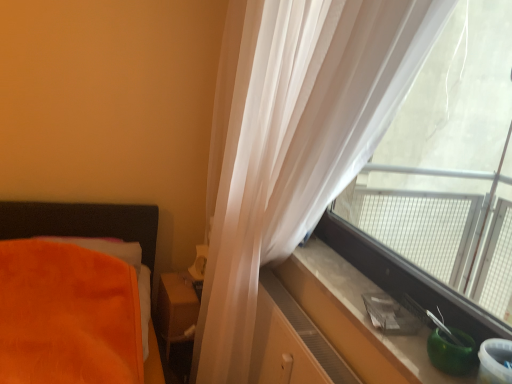
Question: From the image's perspective, does matte wood dresser at lower right appear higher than transparent plastic window at right?

Choices:
 (A) yes
 (B) no

Answer: (B)

Question: Is matte wood dresser at lower right positioned in front of transparent plastic window at right?

Choices:
 (A) no
 (B) yes

Answer: (A)

Question: Can you confirm if matte wood dresser at lower right is thinner than transparent plastic window at right?

Choices:
 (A) no
 (B) yes

Answer: (A)

Question: Does matte wood dresser at lower right have a larger size compared to transparent plastic window at right?

Choices:
 (A) no
 (B) yes

Answer: (A)

Question: Does matte wood dresser at lower right have a lesser height compared to transparent plastic window at right?

Choices:
 (A) yes
 (B) no

Answer: (A)

Question: Visually, is transparent plastic window at right positioned to the left or to the right of matte wood dresser at lower right?

Choices:
 (A) left
 (B) right

Answer: (B)

Question: Is transparent plastic window at right in front of or behind matte wood dresser at lower right in the image?

Choices:
 (A) front
 (B) behind

Answer: (A)

Question: Is transparent plastic window at right taller or shorter than matte wood dresser at lower right?

Choices:
 (A) tall
 (B) short

Answer: (A)

Question: Considering the positions of transparent plastic window at right and matte wood dresser at lower right in the image, is transparent plastic window at right wider or thinner than matte wood dresser at lower right?

Choices:
 (A) wide
 (B) thin

Answer: (B)

Question: Considering the positions of matte brown wooden table at center and transparent plastic window at right in the image, is matte brown wooden table at center wider or thinner than transparent plastic window at right?

Choices:
 (A) thin
 (B) wide

Answer: (B)

Question: Considering the positions of matte brown wooden table at center and transparent plastic window at right in the image, is matte brown wooden table at center taller or shorter than transparent plastic window at right?

Choices:
 (A) tall
 (B) short

Answer: (B)

Question: Is matte brown wooden table at center situated inside transparent plastic window at right or outside?

Choices:
 (A) outside
 (B) inside

Answer: (A)

Question: In terms of size, does matte brown wooden table at center appear bigger or smaller than transparent plastic window at right?

Choices:
 (A) small
 (B) big

Answer: (A)

Question: Is point (283, 274) positioned closer to the camera than point (471, 292)?

Choices:
 (A) closer
 (B) farther

Answer: (A)

Question: Considering the positions of smooth concrete window sill at right and transparent plastic window at right in the image, is smooth concrete window sill at right bigger or smaller than transparent plastic window at right?

Choices:
 (A) small
 (B) big

Answer: (A)